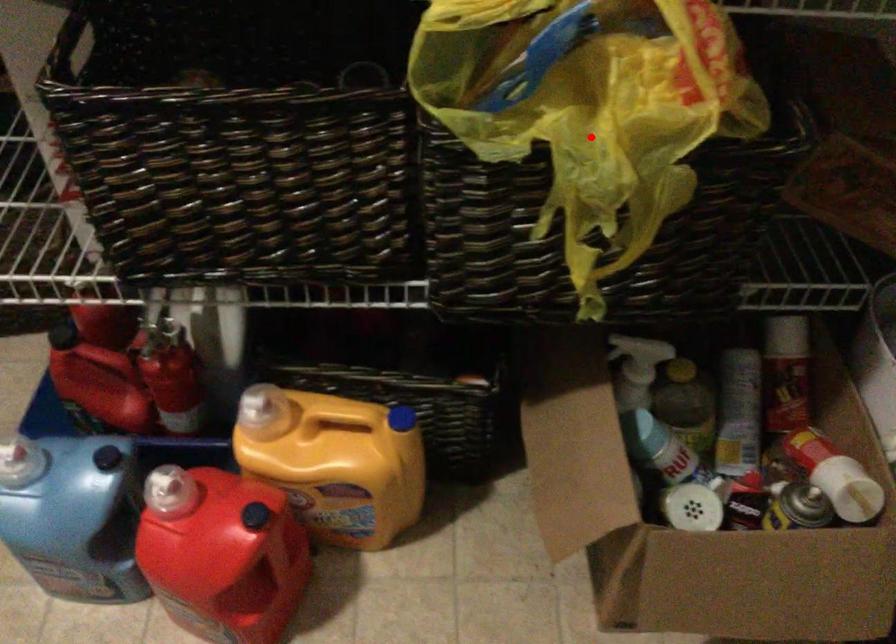
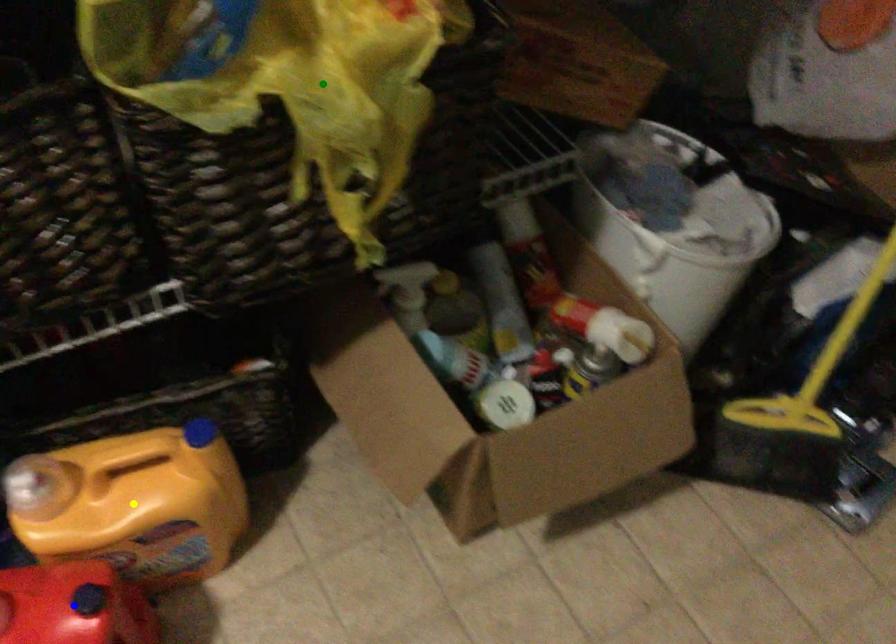
Question: I am providing you with two images of the same scene from different viewpoints. A red point is marked on the first image. You are given multiple points on the second image. Which point in image 2 is actually the same real-world point as the red point in image 1?

Choices:
 (A) blue point
 (B) yellow point
 (C) green point

Answer: (C)